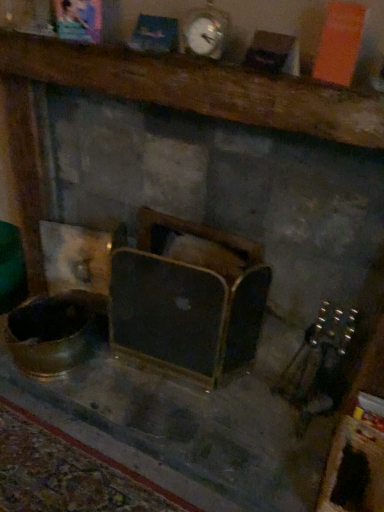
Question: Is wooden framed mirror at center, placed as the first furniture when sorted from bottom to top, surrounded by metallic silver clock at upper center?

Choices:
 (A) yes
 (B) no

Answer: (B)

Question: Is the position of metallic silver clock at upper center more distant than that of wooden framed mirror at center, placed as the first furniture when sorted from bottom to top?

Choices:
 (A) yes
 (B) no

Answer: (B)

Question: Considering the relative sizes of metallic silver clock at upper center and wooden framed mirror at center, which is counted as the 2th furniture, starting from the top, in the image provided, is metallic silver clock at upper center smaller than wooden framed mirror at center, which is counted as the 2th furniture, starting from the top,?

Choices:
 (A) no
 (B) yes

Answer: (B)

Question: Is metallic silver clock at upper center positioned beyond the bounds of wooden framed mirror at center, which is counted as the 2th furniture, starting from the top?

Choices:
 (A) no
 (B) yes

Answer: (B)

Question: Does metallic silver clock at upper center have a lesser width compared to wooden framed mirror at center, placed as the first furniture when sorted from bottom to top?

Choices:
 (A) yes
 (B) no

Answer: (A)

Question: Considering the positions of metallic silver clock at upper center and wooden mantel at upper center, which is counted as the 2th furniture, starting from the bottom, in the image, is metallic silver clock at upper center taller or shorter than wooden mantel at upper center, which is counted as the 2th furniture, starting from the bottom,?

Choices:
 (A) tall
 (B) short

Answer: (A)

Question: Considering the positions of metallic silver clock at upper center and wooden mantel at upper center, which is counted as the 2th furniture, starting from the bottom, in the image, is metallic silver clock at upper center bigger or smaller than wooden mantel at upper center, which is counted as the 2th furniture, starting from the bottom,?

Choices:
 (A) small
 (B) big

Answer: (A)

Question: In the image, is metallic silver clock at upper center positioned in front of or behind wooden mantel at upper center, which is counted as the 2th furniture, starting from the bottom?

Choices:
 (A) behind
 (B) front

Answer: (A)

Question: From the image's perspective, relative to wooden mantel at upper center, which is counted as the 2th furniture, starting from the bottom, is metallic silver clock at upper center above or below?

Choices:
 (A) below
 (B) above

Answer: (B)

Question: From a real-world perspective, is wooden framed mirror at center, placed as the first furniture when sorted from bottom to top, positioned above or below metallic silver clock at upper center?

Choices:
 (A) above
 (B) below

Answer: (B)

Question: Is point [x=180, y=309] positioned closer to the camera than point [x=210, y=44]?

Choices:
 (A) closer
 (B) farther

Answer: (B)

Question: Considering the positions of wooden framed mirror at center, which is counted as the 2th furniture, starting from the top, and metallic silver clock at upper center in the image, is wooden framed mirror at center, which is counted as the 2th furniture, starting from the top, wider or thinner than metallic silver clock at upper center?

Choices:
 (A) thin
 (B) wide

Answer: (B)

Question: In the image, is wooden framed mirror at center, placed as the first furniture when sorted from bottom to top, on the left side or the right side of metallic silver clock at upper center?

Choices:
 (A) left
 (B) right

Answer: (A)

Question: Considering their positions, is wooden mantel at upper center, which is counted as the 2th furniture, starting from the bottom, located in front of or behind wooden framed mirror at center, placed as the first furniture when sorted from bottom to top?

Choices:
 (A) behind
 (B) front

Answer: (B)

Question: Which is correct: wooden mantel at upper center, which is the first furniture from top to bottom, is inside wooden framed mirror at center, which is counted as the 2th furniture, starting from the top, or outside of it?

Choices:
 (A) inside
 (B) outside

Answer: (B)